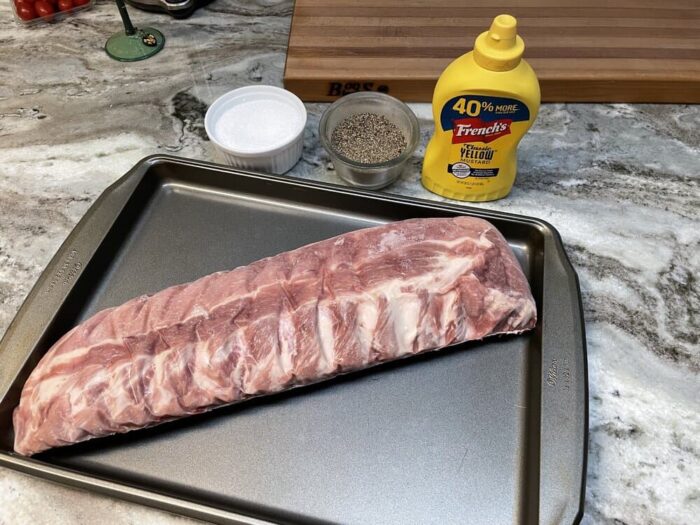
Locate an element on the screen. cutting board is located at coordinates (606, 67).